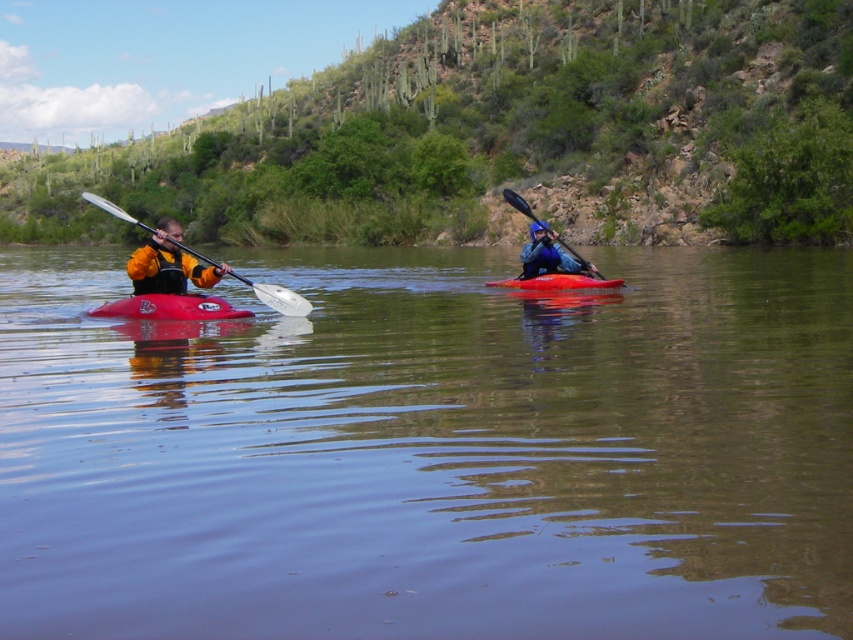
You are standing on the shore of the water and see the green leafy hillside at upper center and the matte red kayak at left. Which object is positioned to the left of the other?

The green leafy hillside at upper center is to the left of the matte red kayak at left.

You are a drone operator trying to capture a photo of the kayakers. The drone is currently hovering above the transparent water at center. To ensure the kayakers are in the frame, should you move the drone north or south? Please explain your reasoning based on the scene description.

The transparent water at center is located at point (431, 451) in 2D coordinates. Since the kayakers are positioned on the water, moving the drone north or south would depend on their exact location relative to this point. However, without additional information about the kayakers position, it is impossible to determine the correct direction. Please provide more details about the kayakers location.

You are a photographer trying to capture the kayakers in the image. You want to focus on the point closer to the camera. Which point should you choose between point (601, 515) and point (164, 240)?

Point (601, 515) is closer to the camera than point (164, 240), so you should choose point (601, 515) to focus on the kayakers.